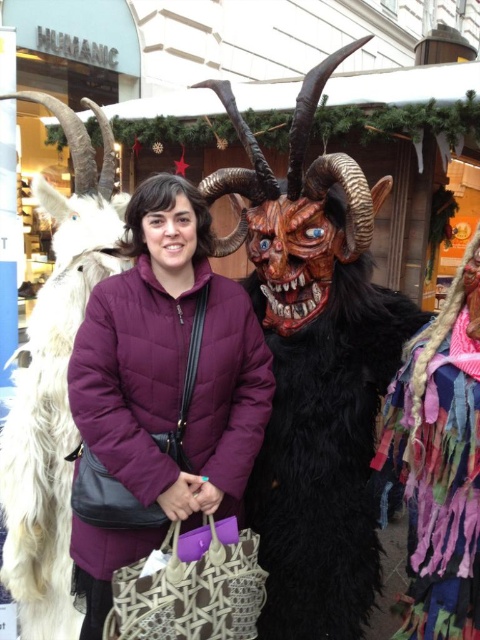
Question: In this image, where is wooden carved mask at center located relative to white fur goat at left?

Choices:
 (A) right
 (B) left

Answer: (A)

Question: Estimate the real-world distances between objects in this image. Which object is closer to the wooden carved mask at center?

Choices:
 (A) purple quilted jacket at center
 (B) white fur goat at left

Answer: (A)

Question: Which point is farther from the camera taking this photo?

Choices:
 (A) (256, 200)
 (B) (191, 404)
 (C) (44, 545)

Answer: (C)

Question: Does purple quilted jacket at center have a smaller size compared to white fur goat at left?

Choices:
 (A) yes
 (B) no

Answer: (A)

Question: Which object appears closest to the camera in this image?

Choices:
 (A) wooden carved mask at center
 (B) purple quilted jacket at center
 (C) white fur goat at left

Answer: (B)

Question: Does purple quilted jacket at center appear on the right side of white fur goat at left?

Choices:
 (A) no
 (B) yes

Answer: (B)